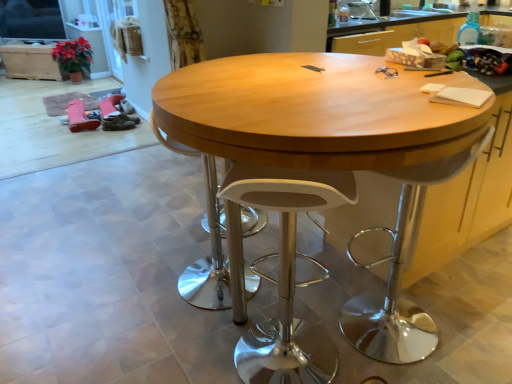
Find the location of a particular element. The width and height of the screenshot is (512, 384). vacant space that's between white plastic swivel chair at center, the first swivel chair when ordered from left to right, and white plastic stool at center is located at coordinates (242, 318).